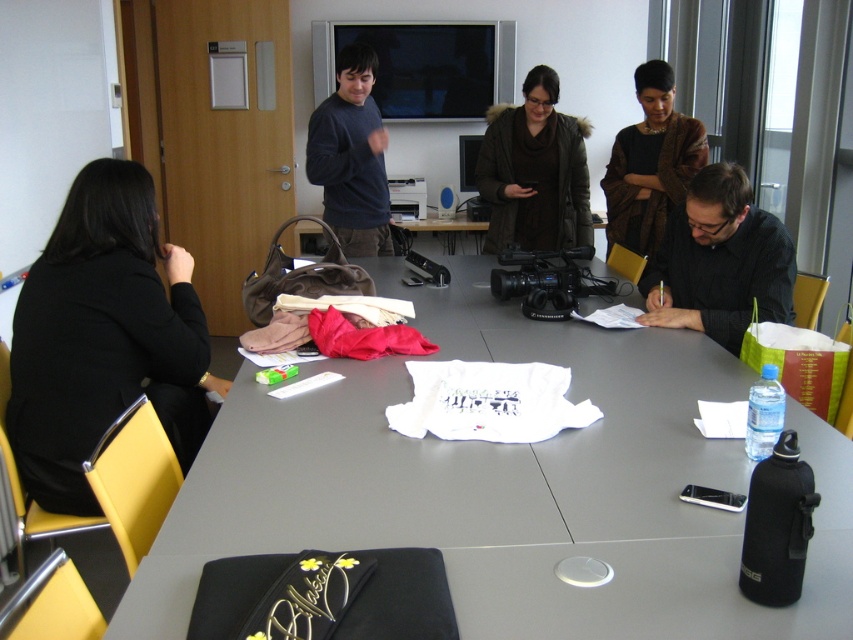
Which is more to the left, brown fuzzy coat at center or dark blue sweater at upper center?

From the viewer's perspective, dark blue sweater at upper center appears more on the left side.

Does brown fuzzy coat at center have a smaller size compared to dark blue sweater at upper center?

No, brown fuzzy coat at center is not smaller than dark blue sweater at upper center.

Who is more distant from viewer, [563,125] or [318,164]?

Positioned behind is point [563,125].

Identify the location of brown fuzzy coat at center. The width and height of the screenshot is (853, 640). (535, 172).

Can you confirm if black fabric jacket at left is thinner than black matte shirt at center?

No.

Does black fabric jacket at left have a smaller size compared to black matte shirt at center?

No.

This screenshot has height=640, width=853. Identify the location of black fabric jacket at left. (103, 337).

Which is more to the left, black matte shirt at center or brown textured coat at upper center?

From the viewer's perspective, black matte shirt at center appears more on the left side.

Can you confirm if black matte shirt at center is positioned to the left of brown textured coat at upper center?

Correct, you'll find black matte shirt at center to the left of brown textured coat at upper center.

Does point (711, 224) come closer to viewer compared to point (694, 125)?

Yes.

I want to click on black matte shirt at center, so click(x=718, y=260).